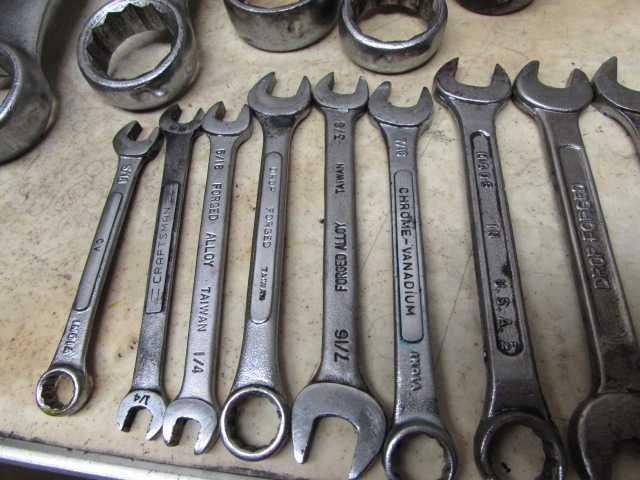
Where is `bench`? bench is located at coordinates (76, 202).